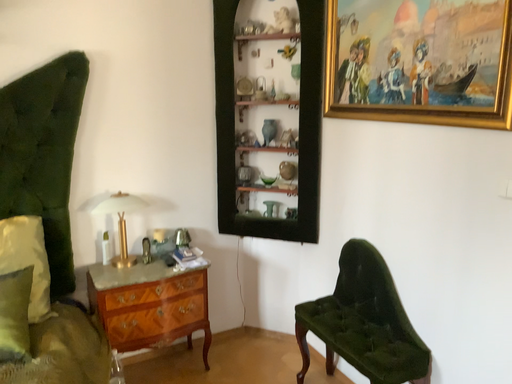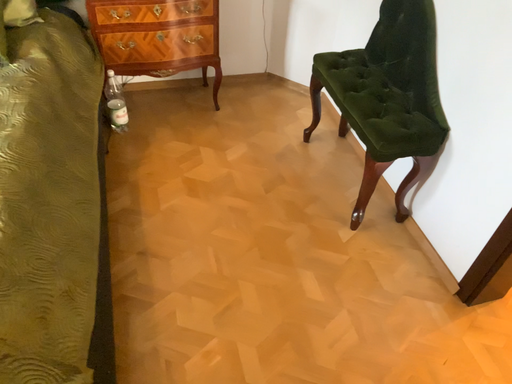
Question: Which way did the camera rotate in the video?

Choices:
 (A) rotated upward
 (B) rotated downward

Answer: (B)